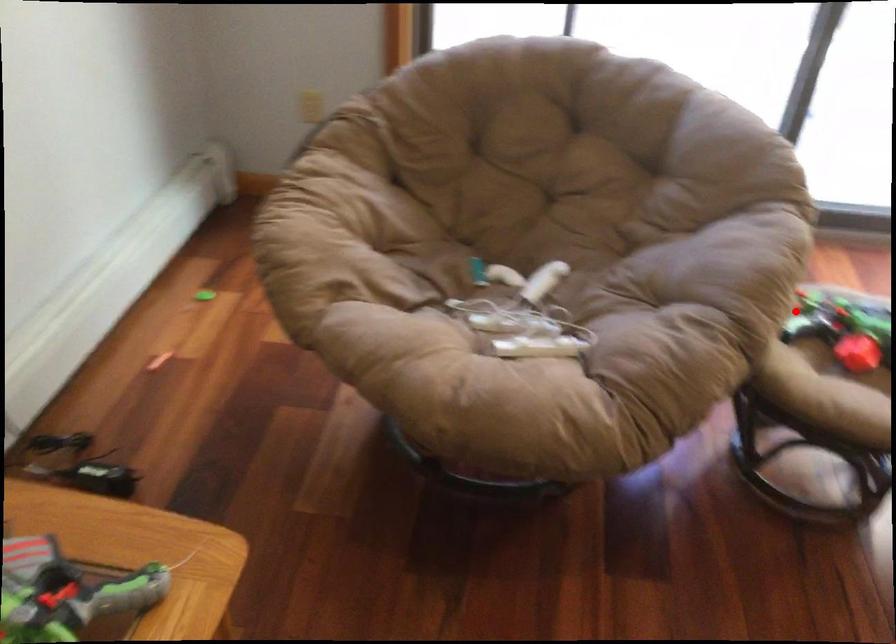
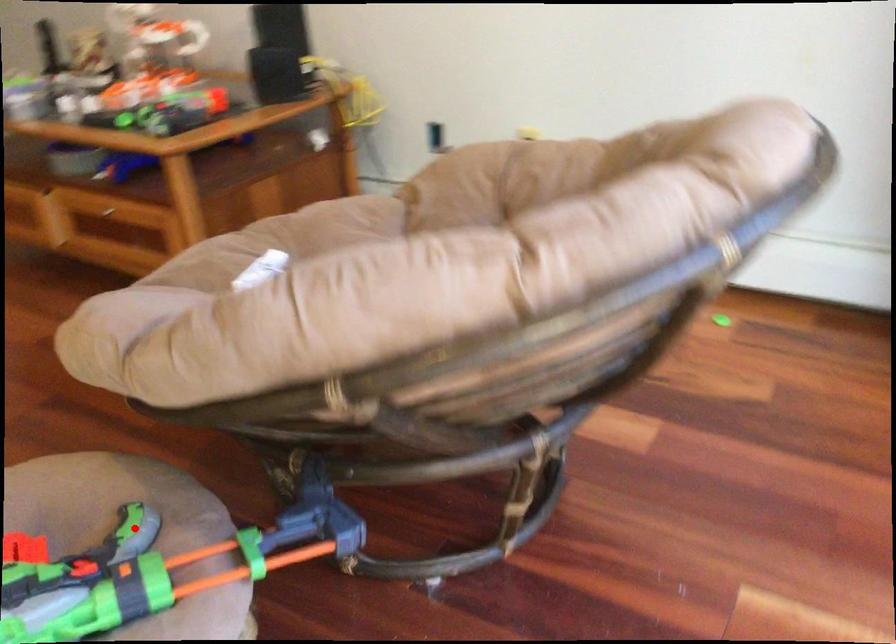
I am providing you with two images of the same scene from different viewpoints. A red point is marked on the first image and another point is marked on the second image. Is the red point in image1 aligned with the point shown in image2?

Yes